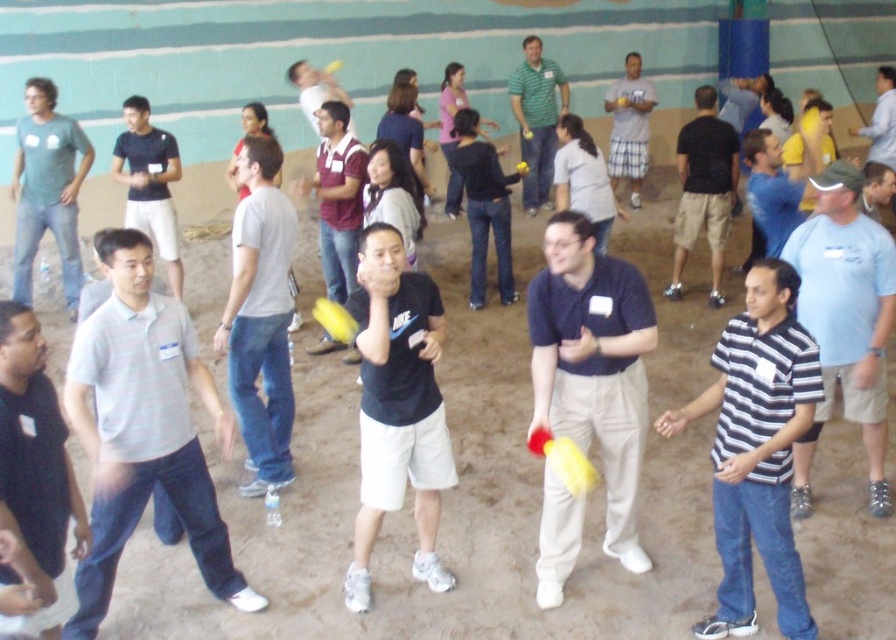
Question: Does light blue t-shirt at center-right have a smaller size compared to maroon jersey at center?

Choices:
 (A) no
 (B) yes

Answer: (A)

Question: Estimate the real-world distances between objects in this image. Which object is closer to the matte black shirt at center?

Choices:
 (A) light blue t-shirt at center-right
 (B) green matte shirt at center
 (C) matte green t-shirt at left

Answer: (C)

Question: Can you confirm if light blue t-shirt at center-right is thinner than light blue plaid shorts at center?

Choices:
 (A) yes
 (B) no

Answer: (B)

Question: Can you confirm if matte blue shirt at center is bigger than striped cotton shirt at center?

Choices:
 (A) no
 (B) yes

Answer: (B)

Question: Which object is positioned farthest from the light gray cotton t-shirt at center?

Choices:
 (A) matte gray shirt at center
 (B) light blue t-shirt at center-right
 (C) dark gray shirt at left
 (D) light blue plaid shorts at center

Answer: (D)

Question: Which object appears farthest from the camera in this image?

Choices:
 (A) maroon jersey at center
 (B) light blue shirt at upper right

Answer: (B)